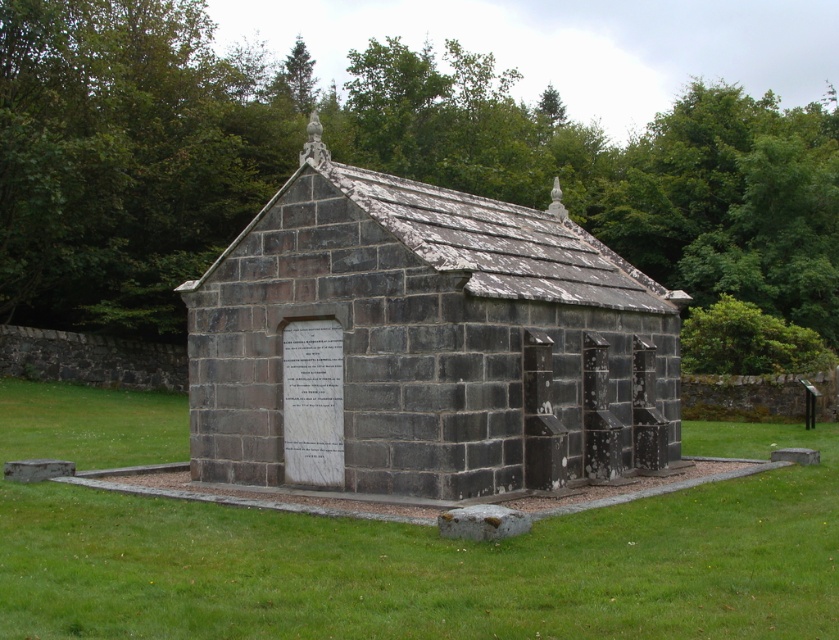
You are standing in front of the dark gray stone church at center and want to take a photo of the green leafy tree at center without any obstructions. Considering their heights, will the tree block the view of the church in your photo?

The green leafy tree at center is taller than the dark gray stone church at center, so if you position yourself where the tree is between you and the church, it might block the view. However, if you move to the side, you can capture the church without obstruction since the tree is taller but not necessarily in front of it.

You are standing in front of the dark gray stone church at center and the green leafy tree at center. Which object is closer to you?

The green leafy tree at center is closer to you because the dark gray stone church at center is behind it.